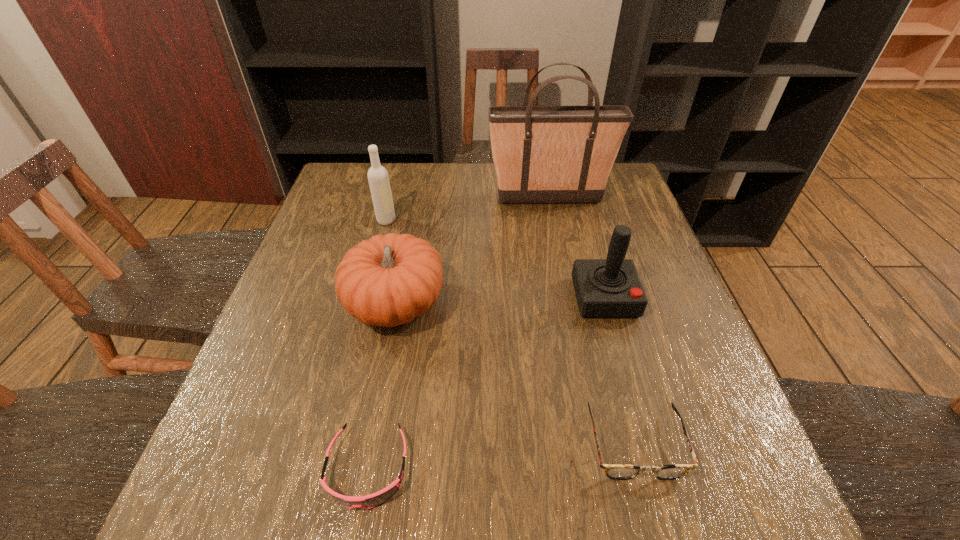
The height and width of the screenshot is (540, 960). I want to click on the tallest object, so click(x=542, y=154).

The image size is (960, 540). Find the location of `the farthest object`. the farthest object is located at coordinates (542, 154).

At what (x,y) coordinates should I click in order to perform the action: click on the fifth nearest object. Please return your answer as a coordinate pair (x, y). This screenshot has width=960, height=540. Looking at the image, I should click on (378, 178).

Find the location of a particular element. The image size is (960, 540). joystick is located at coordinates [605, 288].

Locate an element on the screen. The width and height of the screenshot is (960, 540). pumpkin is located at coordinates (388, 280).

The image size is (960, 540). I want to click on spectacles, so click(x=620, y=471).

The height and width of the screenshot is (540, 960). Find the location of `goggles`. goggles is located at coordinates (370, 501).

Where is `free spot located on the left of the tallest object`? The image size is (960, 540). free spot located on the left of the tallest object is located at coordinates (359, 199).

You are a GUI agent. You are given a task and a screenshot of the screen. Output one action in this format:
    pyautogui.click(x=<x>, y=<y>)
    Task: Click on the free space located on the right of the fifth nearest object
    The image size is (960, 540).
    Given the screenshot: What is the action you would take?
    pyautogui.click(x=511, y=220)

Where is `vacant space situated 0.300m on the base of the joystick`? The height and width of the screenshot is (540, 960). vacant space situated 0.300m on the base of the joystick is located at coordinates (648, 455).